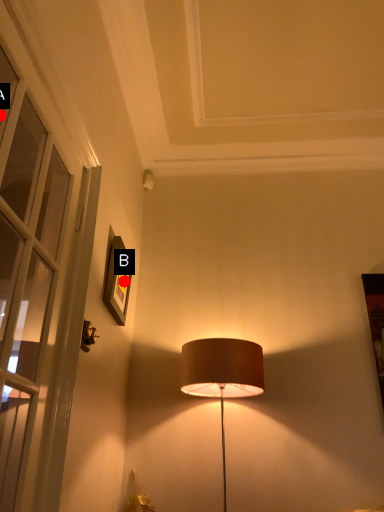
Question: Two points are circled on the image, labeled by A and B beside each circle. Which of the following is the closest to the observer?

Choices:
 (A) A is closer
 (B) B is closer

Answer: (A)